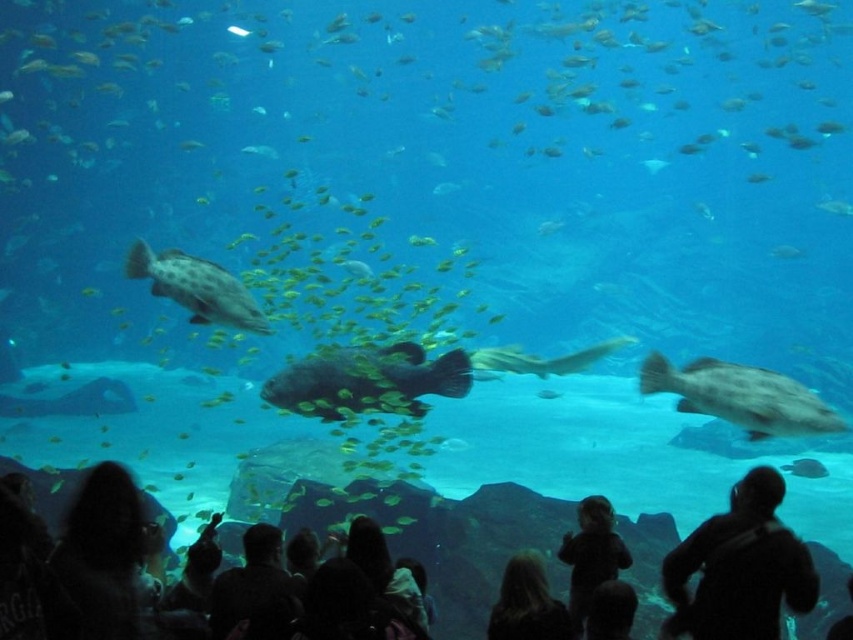
Does shiny black fish at center have a greater width compared to blonde hair at lower center?

Indeed, shiny black fish at center has a greater width compared to blonde hair at lower center.

Which is behind, point (374, 380) or point (498, 602)?

Positioned behind is point (374, 380).

You are a GUI agent. You are given a task and a screenshot of the screen. Output one action in this format:
    pyautogui.click(x=<x>, y=<y>)
    Task: Click on the shiny black fish at center
    This screenshot has height=640, width=853.
    Given the screenshot: What is the action you would take?
    pyautogui.click(x=366, y=380)

Does speckled gray fish at upper left have a greater width compared to blonde hair at lower center?

Correct, the width of speckled gray fish at upper left exceeds that of blonde hair at lower center.

Between point (213, 300) and point (514, 636), which one is positioned in front?

Positioned in front is point (514, 636).

Does point (209, 276) lie in front of point (554, 627)?

No, it is behind (554, 627).

Find the location of a particular element. speckled gray fish at upper left is located at coordinates (196, 288).

Is black matte crowd at lower center taller than dark clothing at lower center?

Yes, black matte crowd at lower center is taller than dark clothing at lower center.

Locate an element on the screen. The width and height of the screenshot is (853, 640). black matte crowd at lower center is located at coordinates (445, 536).

What do you see at coordinates (445, 536) in the screenshot?
I see `black matte crowd at lower center` at bounding box center [445, 536].

Locate an element on the screen. black matte crowd at lower center is located at coordinates (445, 536).